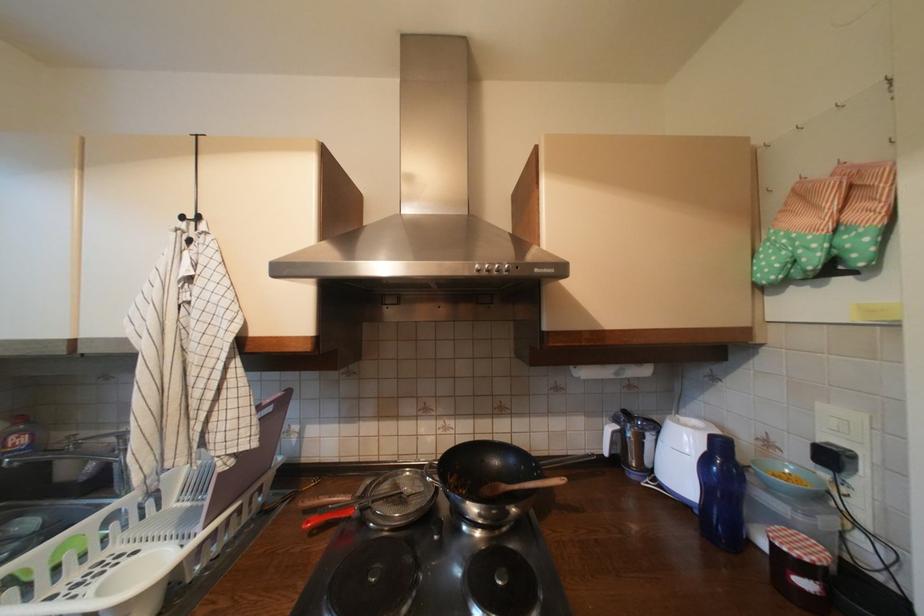
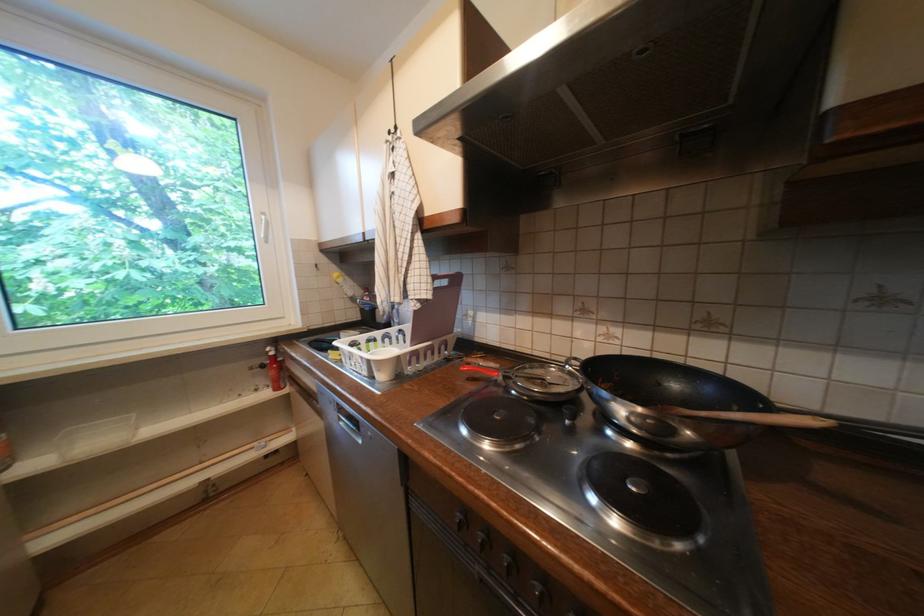
Question: The camera is either moving clockwise (left) or counter-clockwise (right) around the object. The first image is from the beginning of the video and the second image is from the end. Is the camera moving left or right when shooting the video?

Choices:
 (A) Left
 (B) Right

Answer: (B)